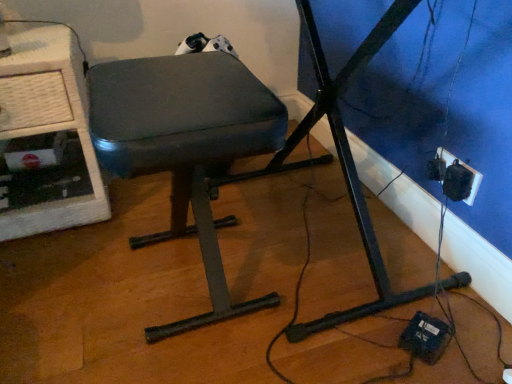
Question: Is black plastic socket at lower right wider than matte black stool at center?

Choices:
 (A) no
 (B) yes

Answer: (A)

Question: Could you tell me if black plastic socket at lower right is turned towards matte black stool at center?

Choices:
 (A) no
 (B) yes

Answer: (B)

Question: Does black plastic socket at lower right have a lesser height compared to matte black stool at center?

Choices:
 (A) yes
 (B) no

Answer: (A)

Question: Is black plastic socket at lower right completely or partially outside of matte black stool at center?

Choices:
 (A) no
 (B) yes

Answer: (B)

Question: Does black plastic socket at lower right appear on the left side of matte black stool at center?

Choices:
 (A) yes
 (B) no

Answer: (B)

Question: From the image's perspective, is matte black stool at center above or below black plastic socket at lower right?

Choices:
 (A) above
 (B) below

Answer: (B)

Question: Is matte black stool at center inside or outside of black plastic socket at lower right?

Choices:
 (A) inside
 (B) outside

Answer: (B)

Question: Is matte black stool at center bigger or smaller than black plastic socket at lower right?

Choices:
 (A) big
 (B) small

Answer: (A)

Question: Is point (204, 208) closer or farther from the camera than point (451, 157)?

Choices:
 (A) farther
 (B) closer

Answer: (B)

Question: In terms of size, does black plastic socket at lower right appear bigger or smaller than matte black stool at center?

Choices:
 (A) big
 (B) small

Answer: (B)

Question: In terms of height, does black plastic socket at lower right look taller or shorter compared to matte black stool at center?

Choices:
 (A) tall
 (B) short

Answer: (B)

Question: Would you say black plastic socket at lower right is to the left or to the right of matte black stool at center in the picture?

Choices:
 (A) left
 (B) right

Answer: (B)

Question: From a real-world perspective, is black plastic socket at lower right above or below matte black stool at center?

Choices:
 (A) below
 (B) above

Answer: (A)

Question: Choose the correct answer: Is matte black stool at center inside white textured computer desk at left or outside it?

Choices:
 (A) outside
 (B) inside

Answer: (A)

Question: From the image's perspective, is matte black stool at center above or below white textured computer desk at left?

Choices:
 (A) above
 (B) below

Answer: (B)